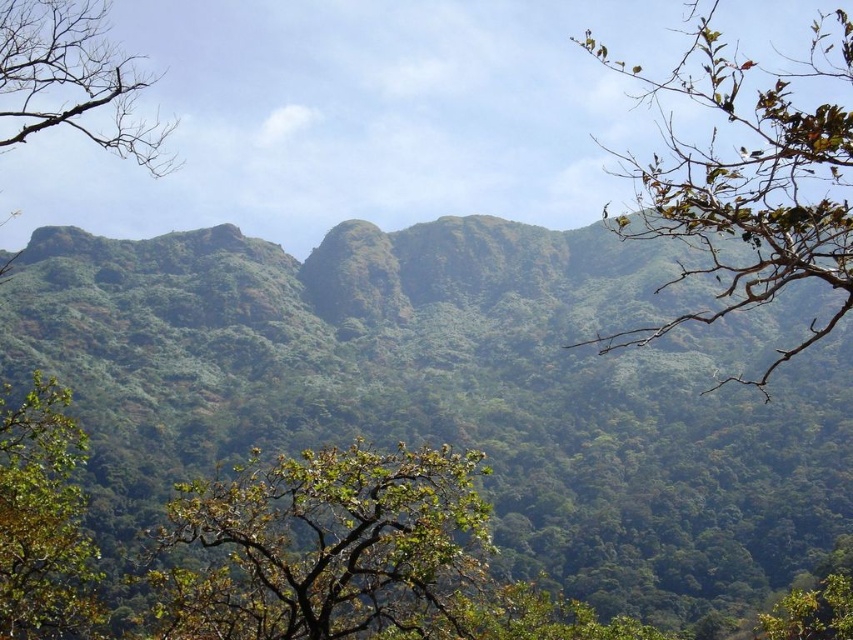
You are an explorer trying to determine the best path to reach the summit of the green leafy mountain at center. You notice a green leafy tree at center in your way. Based on their positions, which object is closer to you and should be navigated around first?

The green leafy tree at center is closer to you than the green leafy mountain at center. You should navigate around the green leafy tree at center first.

You are an explorer looking at the green leafy mountain at center and the green leafy tree at center in the image. Which object is closer to you?

The green leafy tree at center is behind the green leafy mountain at center, so the green leafy mountain at center is closer to you.